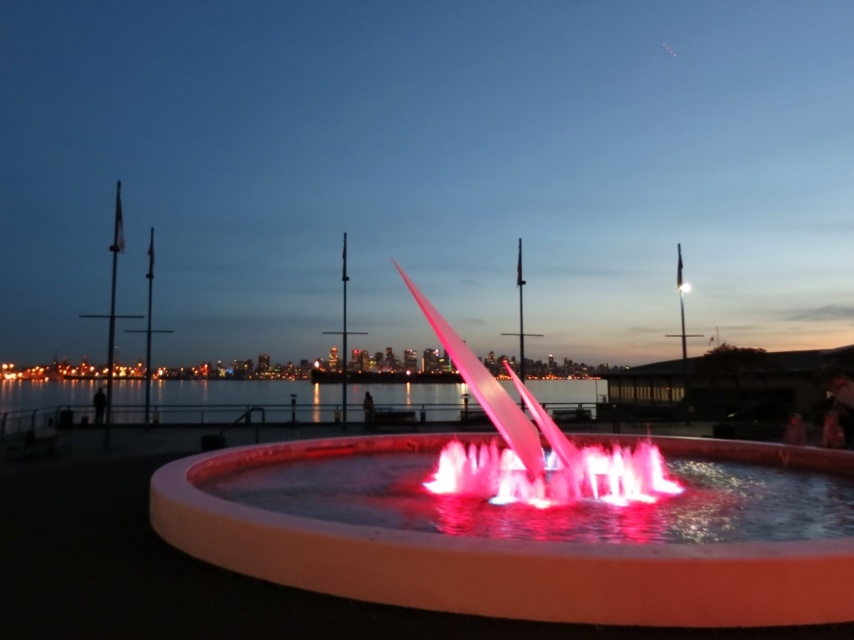
Is matte pink fountain at center above transparent water at center?

Correct, matte pink fountain at center is located above transparent water at center.

Measure the distance between matte pink fountain at center and transparent water at center.

They are 10.14 meters apart.

Which is in front, point (522, 576) or point (423, 392)?

Positioned in front is point (522, 576).

Where is `matte pink fountain at center`? This screenshot has height=640, width=854. matte pink fountain at center is located at coordinates (528, 518).